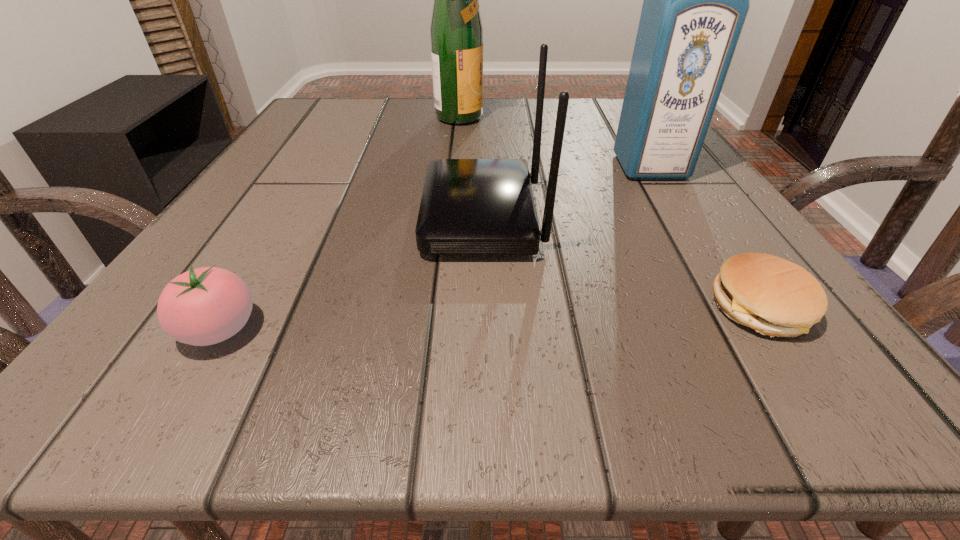
Locate an element on the screen. Image resolution: width=960 pixels, height=540 pixels. free spot between the router and the patty is located at coordinates (621, 262).

You are a GUI agent. You are given a task and a screenshot of the screen. Output one action in this format:
    pyautogui.click(x=<x>, y=<y>)
    Task: Click on the empty space that is in between the third tallest object and the second shortest object
    
    Given the screenshot: What is the action you would take?
    pyautogui.click(x=351, y=273)

You are a GUI agent. You are given a task and a screenshot of the screen. Output one action in this format:
    pyautogui.click(x=<x>, y=<y>)
    Task: Click on the free space that is in between the farther liquor and the tomato
    Image resolution: width=960 pixels, height=540 pixels.
    Given the screenshot: What is the action you would take?
    click(341, 225)

Select which object is the fourth closest to the second shortest object. Please provide its 2D coordinates. Your answer should be formatted as a tuple, i.e. [(x, y)], where the tuple contains the x and y coordinates of a point satisfying the conditions above.

[(696, 0)]

Locate an element on the screen. The height and width of the screenshot is (540, 960). object that is the closest to the left liquor is located at coordinates pyautogui.click(x=469, y=206).

The width and height of the screenshot is (960, 540). I want to click on free region that satisfies the following two spatial constraints: 1. on the flat label side of the right liquor; 2. on the right side of the shortest object, so click(x=737, y=308).

Image resolution: width=960 pixels, height=540 pixels. In order to click on vacant position in the image that satisfies the following two spatial constraints: 1. on the flat label side of the shortest object; 2. on the right side of the right liquor in this screenshot , I will do `click(737, 308)`.

Image resolution: width=960 pixels, height=540 pixels. I want to click on free space in the image that satisfies the following two spatial constraints: 1. on the front-facing side of the farther liquor; 2. on the left side of the shortest object, so click(445, 308).

Locate an element on the screen. vacant position in the image that satisfies the following two spatial constraints: 1. on the flat label side of the shortest object; 2. on the right side of the right liquor is located at coordinates (737, 308).

I want to click on free region that satisfies the following two spatial constraints: 1. on the front-facing side of the shortest object; 2. on the left side of the router, so click(484, 308).